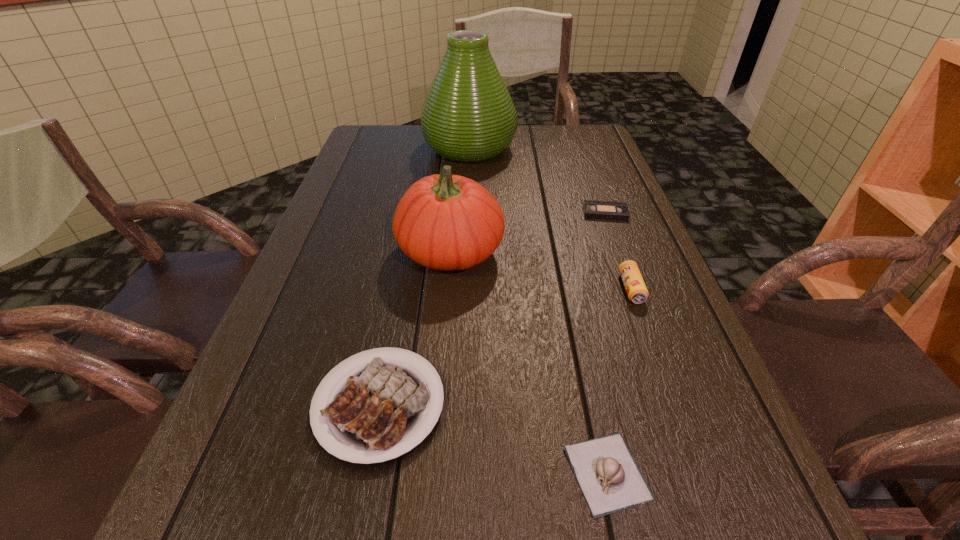
At what (x,y) coordinates should I click in order to perform the action: click on vacant point located between the garlic and the shortest object. Please return your answer as a coordinate pair (x, y). The image size is (960, 540). Looking at the image, I should click on (606, 342).

The width and height of the screenshot is (960, 540). Find the location of `vacant area that lies between the plate and the shortest object`. vacant area that lies between the plate and the shortest object is located at coordinates (492, 308).

Locate an element on the screen. Image resolution: width=960 pixels, height=540 pixels. free space between the fourth tallest object and the garlic is located at coordinates (493, 438).

Where is `vacant space that is in between the garlic and the shortest object`? The height and width of the screenshot is (540, 960). vacant space that is in between the garlic and the shortest object is located at coordinates (606, 342).

Locate which object ranks in proximity to the second shortest object. Please provide its 2D coordinates. Your answer should be formatted as a tuple, i.e. [(x, y)], where the tuple contains the x and y coordinates of a point satisfying the conditions above.

[(375, 411)]

Find the location of a particular element. The width and height of the screenshot is (960, 540). object that is the fourth closest one to the videotape is located at coordinates click(375, 411).

Locate an element on the screen. The height and width of the screenshot is (540, 960). vacant space that satisfies the following two spatial constraints: 1. on the back side of the tallest object; 2. on the left side of the fifth shortest object is located at coordinates (459, 148).

Locate an element on the screen. The image size is (960, 540). blank area in the image that satisfies the following two spatial constraints: 1. on the front side of the third tallest object; 2. on the left side of the pumpkin is located at coordinates (447, 288).

This screenshot has width=960, height=540. What are the coordinates of `free spot that satisfies the following two spatial constraints: 1. on the front side of the tallest object; 2. on the right side of the third tallest object` in the screenshot? It's located at (464, 288).